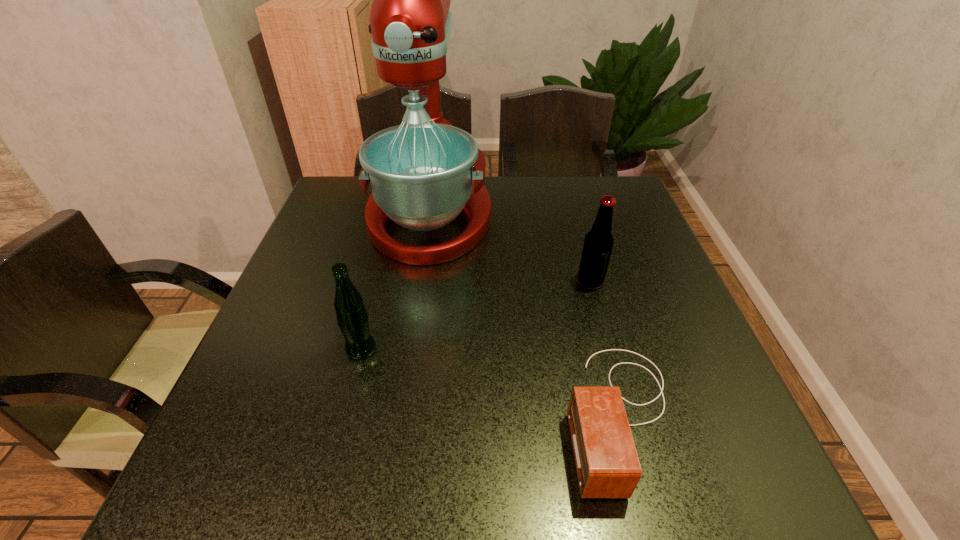
At what (x,y) coordinates should I click in order to perform the action: click on the tallest object. Please return your answer as a coordinate pair (x, y). The width and height of the screenshot is (960, 540). Looking at the image, I should click on (424, 173).

I want to click on the farthest object, so click(424, 173).

The width and height of the screenshot is (960, 540). I want to click on the right beer bottle, so click(x=598, y=243).

Find the location of a particular element. The image size is (960, 540). the farther beer bottle is located at coordinates (598, 243).

Identify the location of the nearer beer bottle. (352, 317).

You are a GUI agent. You are given a task and a screenshot of the screen. Output one action in this format:
    pyautogui.click(x=<x>, y=<y>)
    Task: Click on the radio receiver
    This screenshot has height=540, width=960.
    Given the screenshot: What is the action you would take?
    pyautogui.click(x=607, y=465)

Where is `vacant region located 0.150m on the front-facing side of the tallest object`? This screenshot has width=960, height=540. vacant region located 0.150m on the front-facing side of the tallest object is located at coordinates (416, 314).

You are a GUI agent. You are given a task and a screenshot of the screen. Output one action in this format:
    pyautogui.click(x=<x>, y=<y>)
    Task: Click on the blank space located on the left of the right beer bottle
    
    Given the screenshot: What is the action you would take?
    pyautogui.click(x=521, y=281)

Find the location of `free space located on the back of the nearer beer bottle`. free space located on the back of the nearer beer bottle is located at coordinates (379, 276).

Where is `vacant space situated 0.070m on the front-facing side of the radio receiver`? The width and height of the screenshot is (960, 540). vacant space situated 0.070m on the front-facing side of the radio receiver is located at coordinates (526, 415).